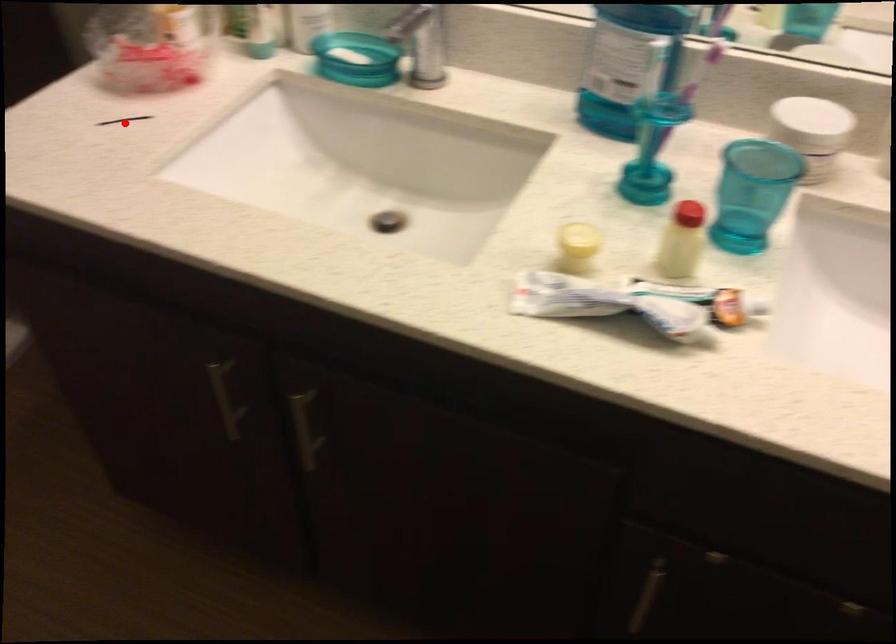
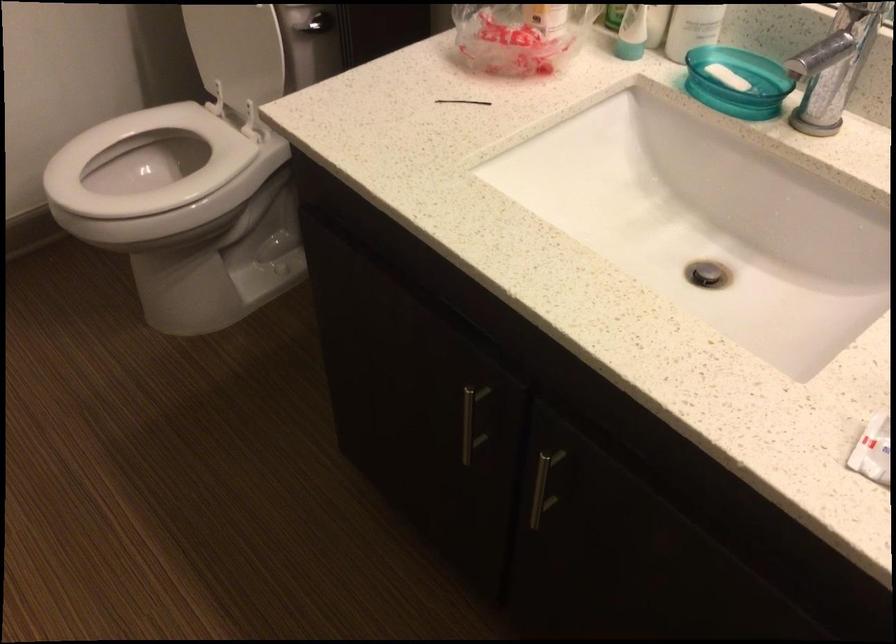
The point at the highlighted location is marked in the first image. Where is the corresponding point in the second image?

(462, 102)